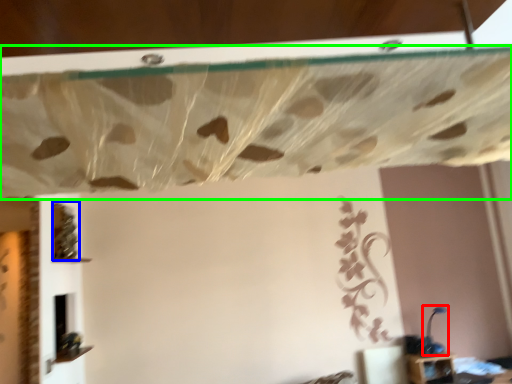
Question: Which object is positioned farthest from lamp (highlighted by a red box)? Select from vine (highlighted by a blue box) and curtain (highlighted by a green box).

Choices:
 (A) vine
 (B) curtain

Answer: (B)